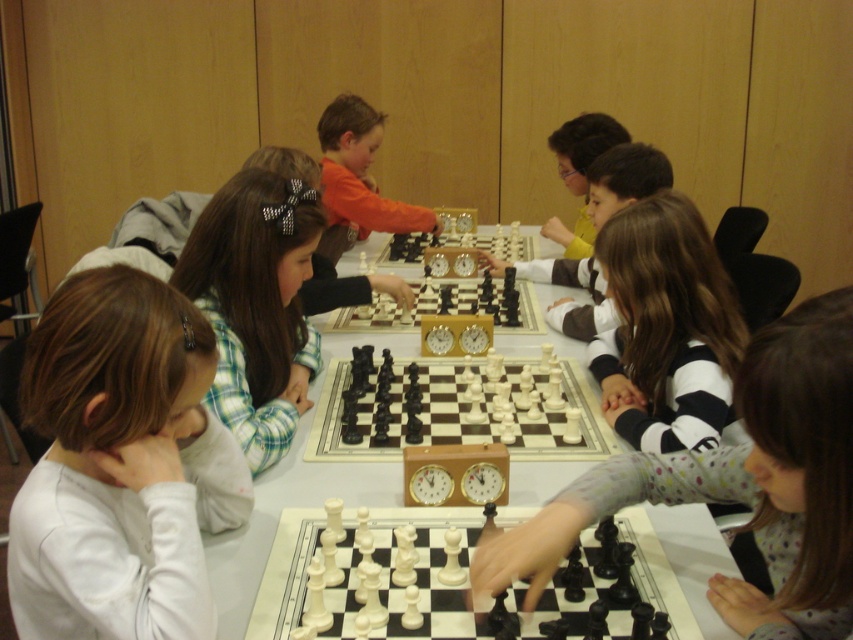
Question: Where is white matte shirt at lower left located in relation to orange fabric shirt at center in the image?

Choices:
 (A) below
 (B) above

Answer: (A)

Question: Is black and white striped shirt at center further to camera compared to plaid fabric shirt at center?

Choices:
 (A) no
 (B) yes

Answer: (B)

Question: Which of the following is the closest to the observer?

Choices:
 (A) (811, 380)
 (B) (285, 451)

Answer: (A)

Question: Considering the real-world distances, which object is farthest from the white matte shirt at lower left?

Choices:
 (A) matte black chess piece at center
 (B) orange fabric shirt at center
 (C) plaid fabric shirt at center
 (D) black and white striped shirt at center

Answer: (A)

Question: Which point appears farthest from the camera in this image?

Choices:
 (A) (718, 604)
 (B) (253, 406)

Answer: (B)

Question: Does polka dot fabric shirt at center come in front of black and white striped shirt at center?

Choices:
 (A) yes
 (B) no

Answer: (A)